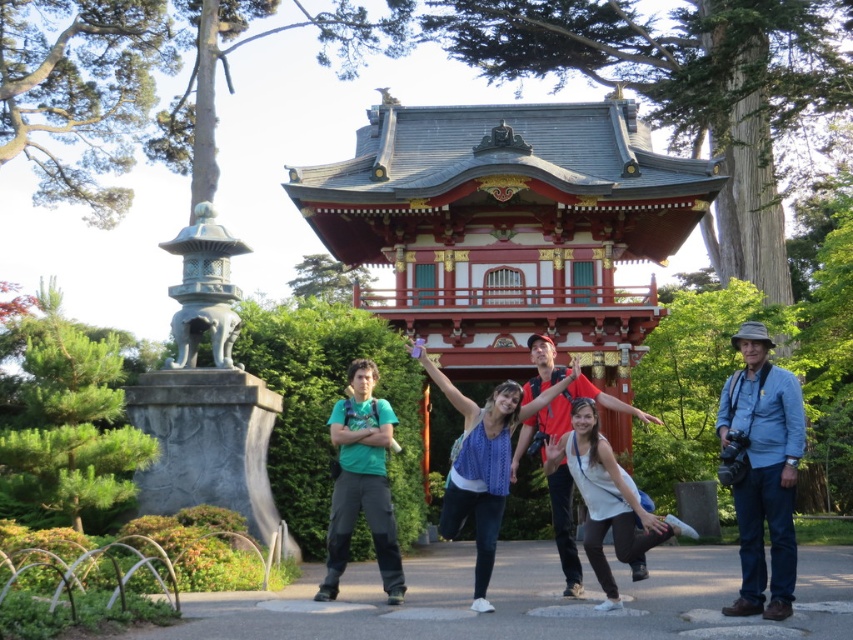
You are a photographer trying to capture a group photo of the tourists at the Japanese pavilion. You notice two outfits in the scene, the blue denim jeans at right and the white cotton dress at center. Which outfit appears narrower in the photo?

The blue denim jeans at right appears narrower because its width is less than the white cotton dress at center.

You are standing at the center of the image. Looking towards the right side, you see a point marked at coordinates [762,470]. What object is located at this point?

The point at coordinates [762,470] marks blue denim jeans at right.